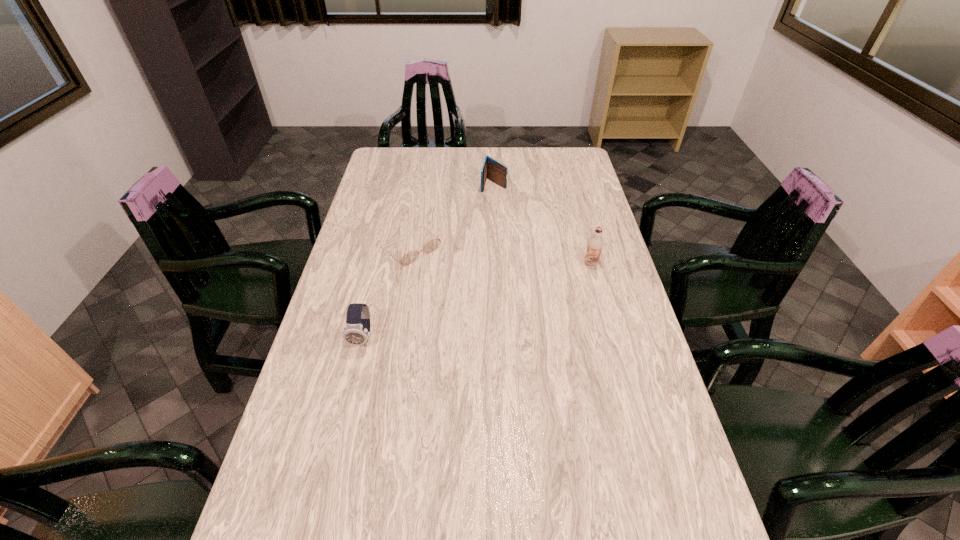
The image size is (960, 540). Find the location of `watch`. watch is located at coordinates (357, 331).

Locate an element on the screen. the tallest object is located at coordinates (595, 243).

Where is `chocolate milk`? This screenshot has width=960, height=540. chocolate milk is located at coordinates (595, 243).

Where is `the second object from right to left`? the second object from right to left is located at coordinates (493, 170).

I want to click on the second shortest object, so click(x=493, y=170).

At what (x,y) coordinates should I click in order to perform the action: click on the shortest object. Please return your answer as a coordinate pair (x, y). The image size is (960, 540). Looking at the image, I should click on (432, 245).

The height and width of the screenshot is (540, 960). What are the coordinates of `free space located on the face of the nearest object` in the screenshot? It's located at (353, 377).

Where is `free space located on the left of the rightmost object`? free space located on the left of the rightmost object is located at coordinates (477, 263).

Locate an element on the screen. The width and height of the screenshot is (960, 540). vacant area situated 0.370m on the exterior surface of the wallet is located at coordinates (475, 253).

Find the location of a particular element. vacant point located on the exterior surface of the wallet is located at coordinates (486, 213).